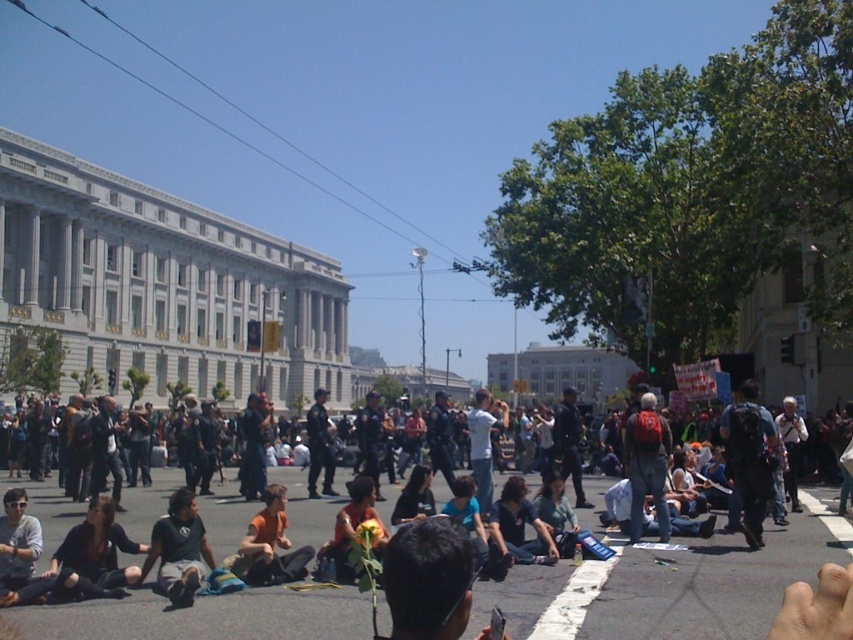
Question: Can you confirm if dark green t-shirt at lower left is bigger than red backpack at center?

Choices:
 (A) yes
 (B) no

Answer: (B)

Question: Which point is closer to the camera?

Choices:
 (A) (637, 493)
 (B) (183, 584)
 (C) (567, 614)

Answer: (C)

Question: Which point is farther to the camera?

Choices:
 (A) dark blue shirt at center
 (B) dark blue uniform at center
 (C) orange t-shirt at center

Answer: (B)

Question: Does dark blue backpack at center have a larger size compared to dark blue uniform at center?

Choices:
 (A) yes
 (B) no

Answer: (B)

Question: Considering the real-world distances, which object is closest to the dark blue jeans at lower center?

Choices:
 (A) dark blue uniform at center
 (B) dark blue shirt at center

Answer: (B)

Question: Considering the relative positions of dark blue jeans at lower center and dark green t-shirt at lower left in the image provided, where is dark blue jeans at lower center located with respect to dark green t-shirt at lower left?

Choices:
 (A) left
 (B) right

Answer: (B)